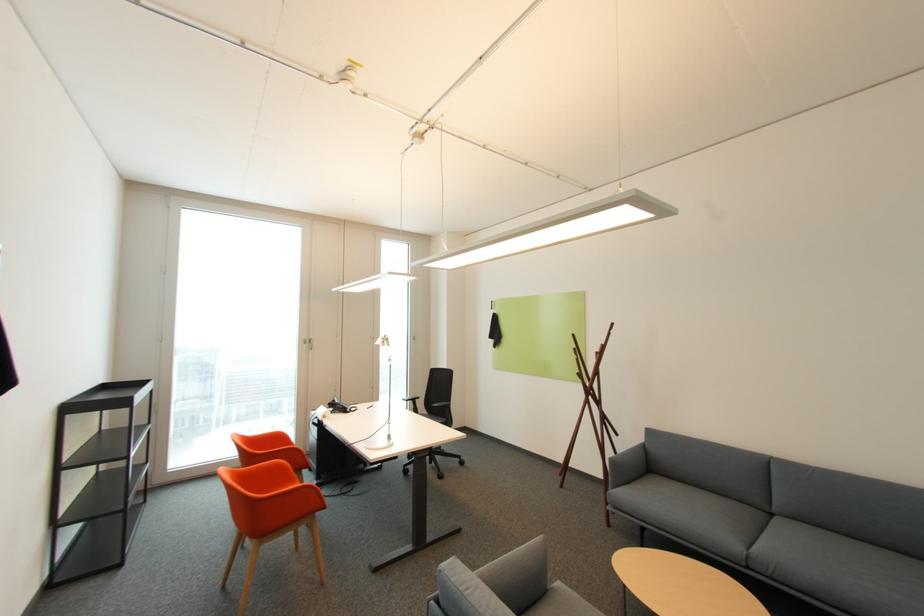
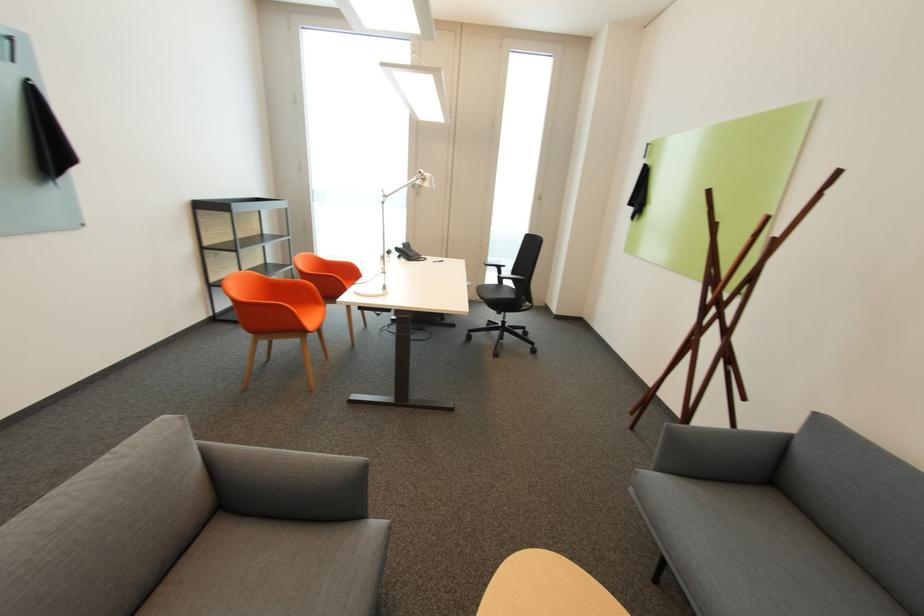
In the second image, find the point that corresponds to point 355,411 in the first image.

(419, 259)